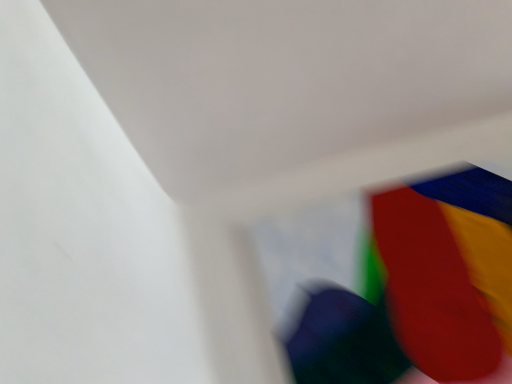
What is the approximate height of textured fabric flag at center?

It is 32.60 inches.

Where is `textured fabric flag at center`? This screenshot has height=384, width=512. textured fabric flag at center is located at coordinates (418, 289).

This screenshot has width=512, height=384. Describe the element at coordinates (418, 289) in the screenshot. I see `textured fabric flag at center` at that location.

Where is `textured fabric flag at center`? Image resolution: width=512 pixels, height=384 pixels. textured fabric flag at center is located at coordinates (418, 289).